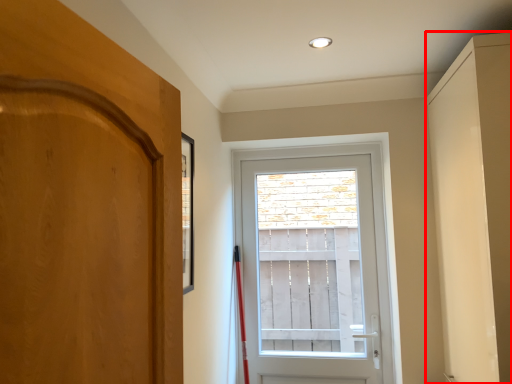
Question: Where is cabinetry (annotated by the red box) located in relation to door in the image?

Choices:
 (A) left
 (B) right

Answer: (B)